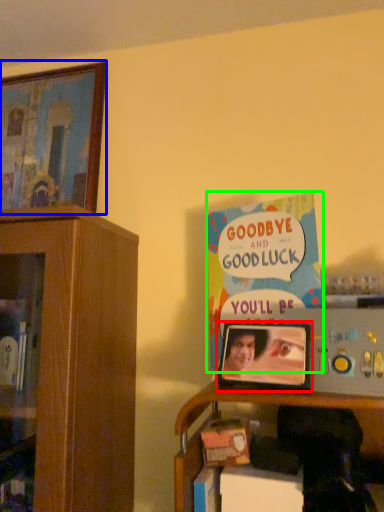
Question: Which object is the farthest from picture frame (highlighted by a red box)? Choose among these: picture frame (highlighted by a blue box) or book (highlighted by a green box).

Choices:
 (A) picture frame
 (B) book

Answer: (A)